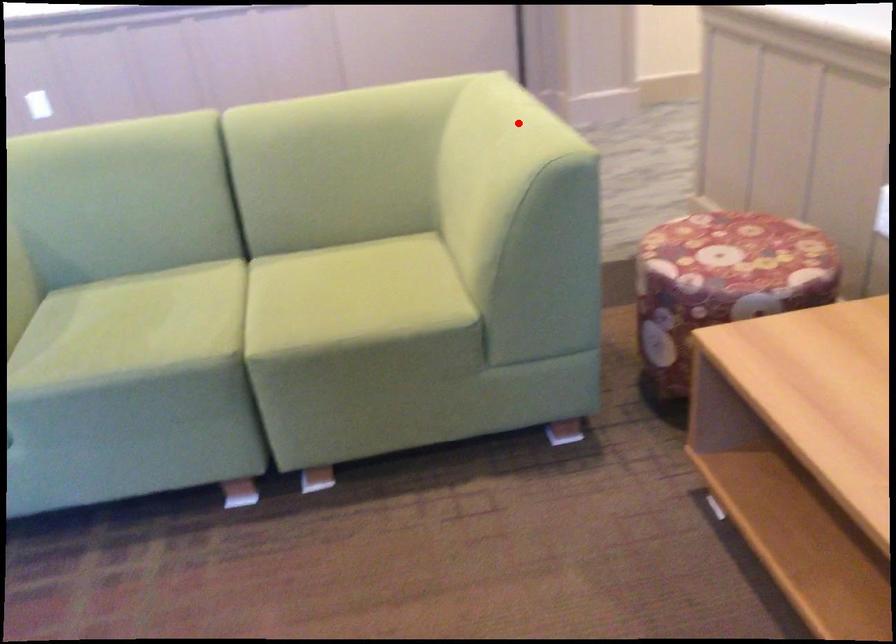
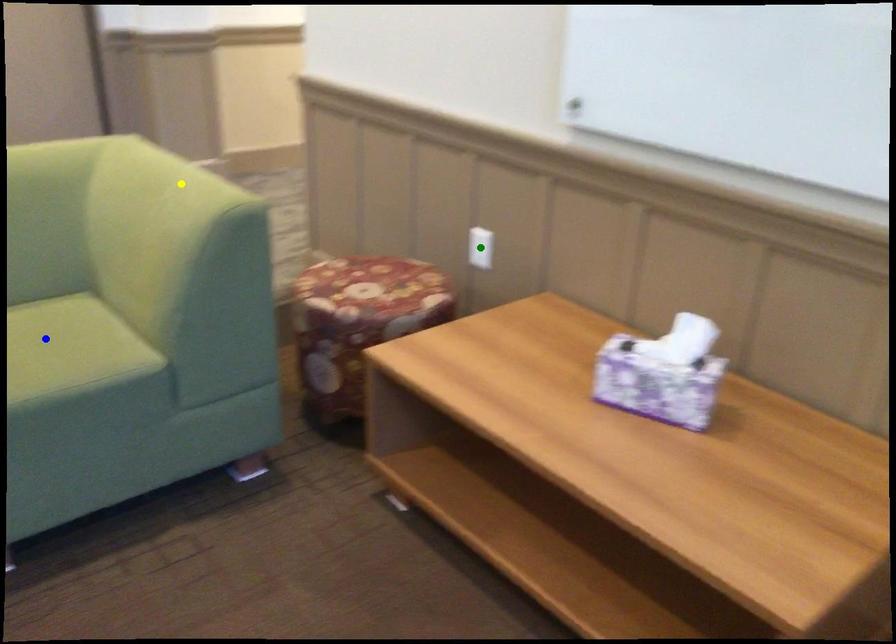
Question: I am providing you with two images of the same scene from different viewpoints. A red point is marked on the first image. You are given multiple points on the second image. Which point in image 2 represents the same 3d spot as the red point in image 1?

Choices:
 (A) yellow point
 (B) blue point
 (C) green point

Answer: (A)